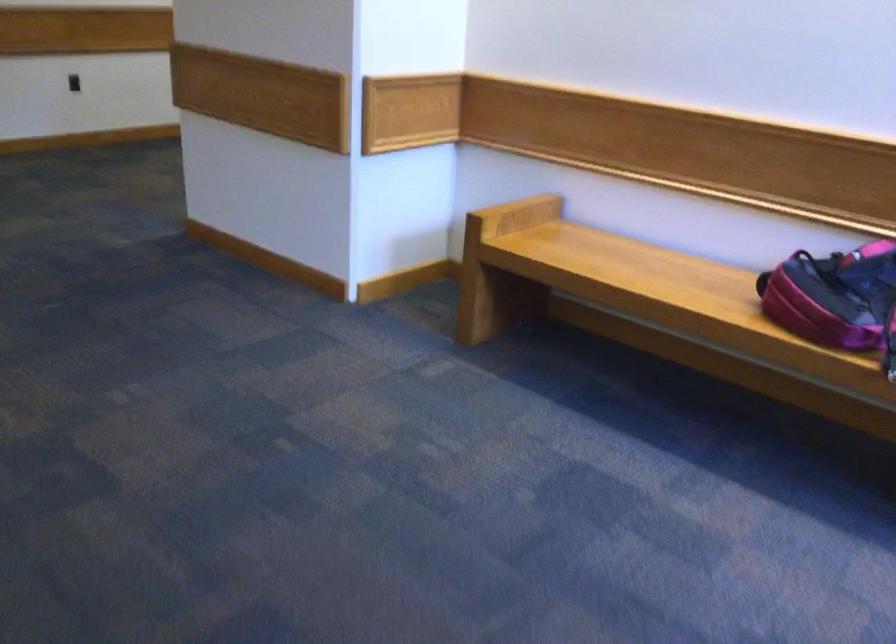
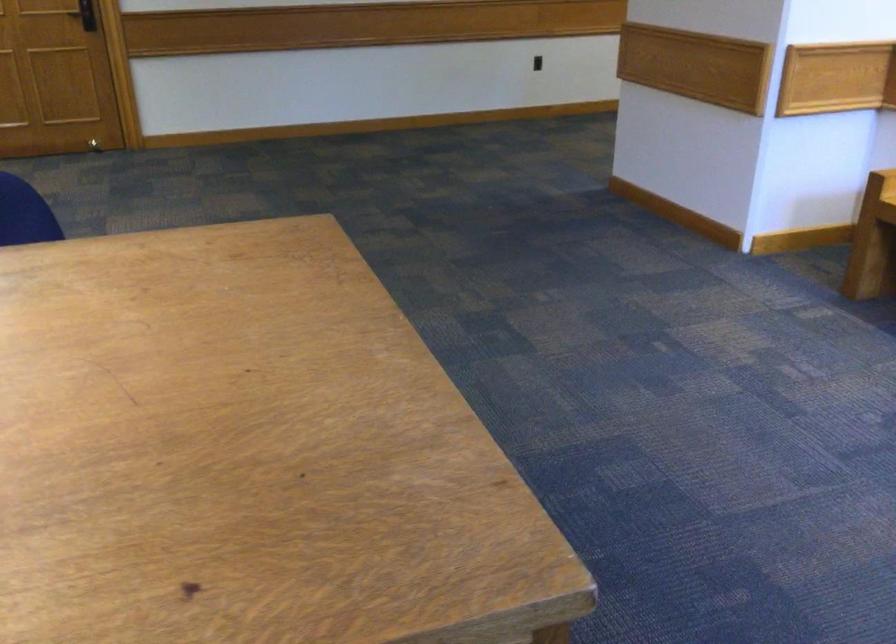
The point at (72,272) is marked in the first image. Where is the corresponding point in the second image?

(515, 214)